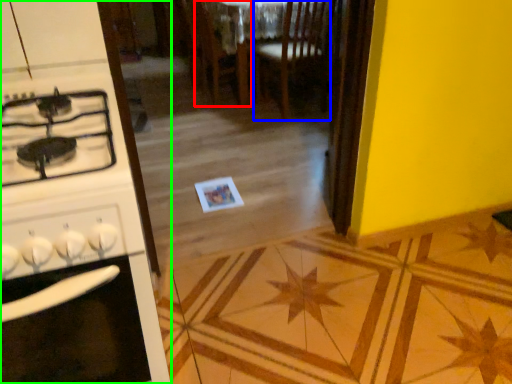
Question: Considering the real-world distances, which object is closest to chair (highlighted by a red box)? chair (highlighted by a blue box) or kitchen appliance (highlighted by a green box).

Choices:
 (A) chair
 (B) kitchen appliance

Answer: (A)